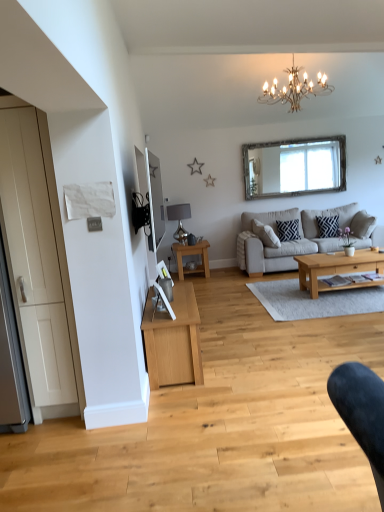
Question: Based on their positions, is silver-framed mirror at upper center, marked as the 1th mirror in a back-to-front arrangement, located to the left or right of gold metallic chandelier at upper center?

Choices:
 (A) left
 (B) right

Answer: (B)

Question: Relative to gold metallic chandelier at upper center, is silver-framed mirror at upper center, the first mirror positioned from the right, in front or behind?

Choices:
 (A) front
 (B) behind

Answer: (B)

Question: Which object is the farthest from the light brown wooden coffee table at center, the 2th coffee table viewed from the left?

Choices:
 (A) dark blue textured pillow at center right, which ranks as the second pillow in left-to-right order
 (B) light gray fabric couch at center
 (C) light wood/texture coffee table at center, the 2th coffee table when ordered from front to back
 (D) gold metallic chandelier at upper center
 (E) matte silver lamp at center-left

Answer: (E)

Question: Considering the real-world distances, which object is closest to the white matte door at left?

Choices:
 (A) dark blue geometric-patterned pillow at center, the 1th pillow in the left-to-right sequence
 (B) dark blue textured pillow at center right, acting as the 1th pillow starting from the right
 (C) matte silver lamp at center-left
 (D) light wood/texture coffee table at center, the 2th coffee table in the right-to-left sequence
 (E) gold metallic chandelier at upper center

Answer: (D)